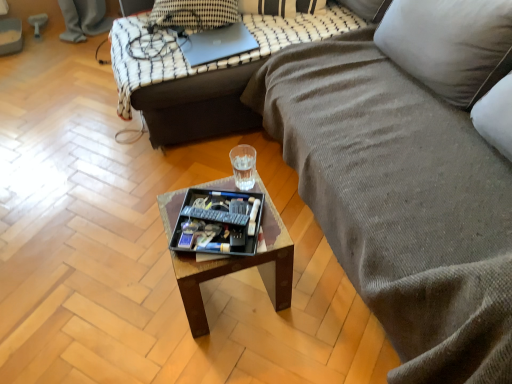
Question: Is textured gray fabric couch at center, positioned as the 2th studio couch in back-to-front order, surrounding metallic gray swivel chair at upper left?

Choices:
 (A) no
 (B) yes

Answer: (A)

Question: From a real-world perspective, is textured gray fabric couch at center, which ranks as the 1th studio couch in front-to-back order, located higher than metallic gray swivel chair at upper left?

Choices:
 (A) yes
 (B) no

Answer: (A)

Question: Is textured gray fabric couch at center, which ranks as the 1th studio couch in front-to-back order, facing away from metallic gray swivel chair at upper left?

Choices:
 (A) no
 (B) yes

Answer: (A)

Question: Is textured gray fabric couch at center, which ranks as the 1th studio couch in front-to-back order, to the left of metallic gray swivel chair at upper left from the viewer's perspective?

Choices:
 (A) yes
 (B) no

Answer: (B)

Question: Does textured gray fabric couch at center, positioned as the 2th studio couch in back-to-front order, lie behind metallic gray swivel chair at upper left?

Choices:
 (A) no
 (B) yes

Answer: (A)

Question: From the image's perspective, relative to black plastic tray at center, is transparent plastic glass at center above or below?

Choices:
 (A) above
 (B) below

Answer: (A)

Question: Is transparent plastic glass at center inside or outside of black plastic tray at center?

Choices:
 (A) outside
 (B) inside

Answer: (A)

Question: In terms of height, does transparent plastic glass at center look taller or shorter compared to black plastic tray at center?

Choices:
 (A) short
 (B) tall

Answer: (B)

Question: Would you say transparent plastic glass at center is to the left or to the right of black plastic tray at center in the picture?

Choices:
 (A) left
 (B) right

Answer: (B)

Question: Considering the positions of wooden tray at center and black plastic remote control at center in the image, is wooden tray at center bigger or smaller than black plastic remote control at center?

Choices:
 (A) small
 (B) big

Answer: (B)

Question: Does point (260, 266) appear closer or farther from the camera than point (198, 211)?

Choices:
 (A) closer
 (B) farther

Answer: (B)

Question: From a real-world perspective, is wooden tray at center above or below black plastic remote control at center?

Choices:
 (A) below
 (B) above

Answer: (A)

Question: Do you think wooden tray at center is within black plastic remote control at center, or outside of it?

Choices:
 (A) outside
 (B) inside

Answer: (A)

Question: In terms of height, does sleek silver laptop at upper center look taller or shorter compared to textured gray fabric couch at center, which ranks as the 1th studio couch in front-to-back order?

Choices:
 (A) short
 (B) tall

Answer: (A)

Question: Considering the positions of sleek silver laptop at upper center and textured gray fabric couch at center, positioned as the 2th studio couch in back-to-front order, in the image, is sleek silver laptop at upper center wider or thinner than textured gray fabric couch at center, positioned as the 2th studio couch in back-to-front order,?

Choices:
 (A) thin
 (B) wide

Answer: (A)